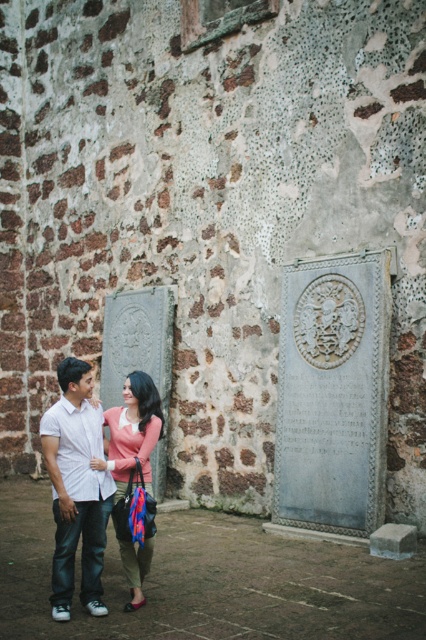
Can you confirm if white cotton shirt at center is taller than pink matte sweater at center?

Result: Yes.

Does point (94, 602) lie behind point (129, 550)?

No.

Where is `white cotton shirt at center`? Image resolution: width=426 pixels, height=640 pixels. white cotton shirt at center is located at coordinates (77, 488).